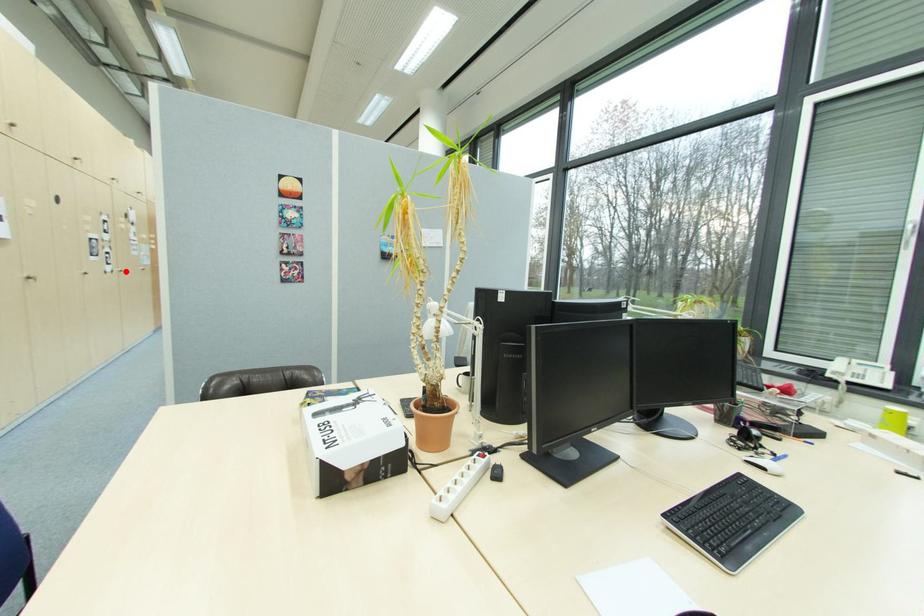
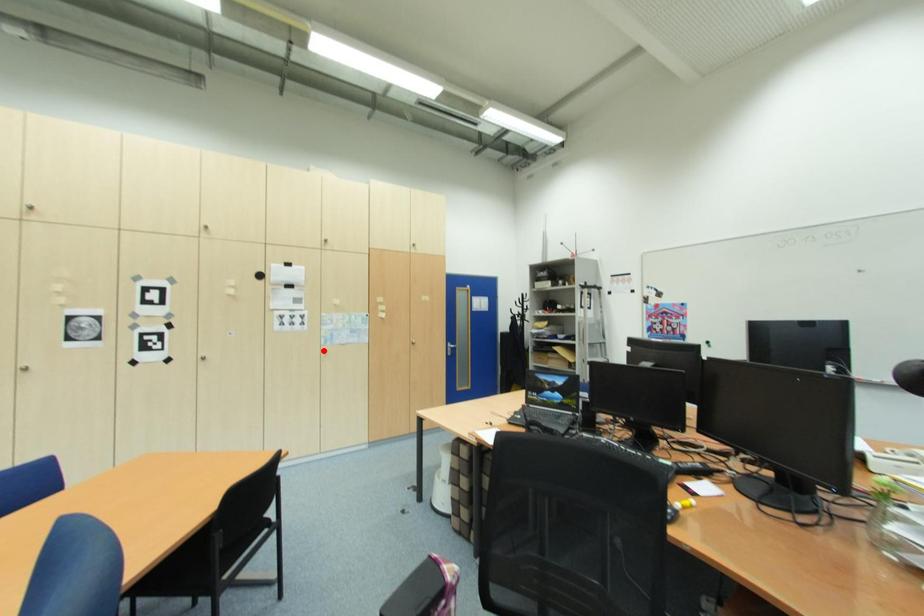
I am providing you with two images of the same scene from different viewpoints. A red point is marked on the first image and another point is marked on the second image. Are the points marked in image1 and image2 representing the same 3D position?

No